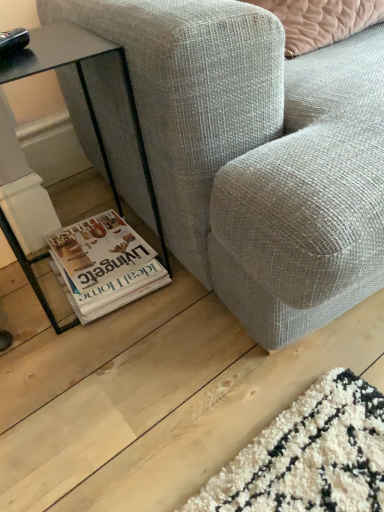
Locate an element on the screen. This screenshot has width=384, height=512. free point in front of black glass table at lower left is located at coordinates (97, 362).